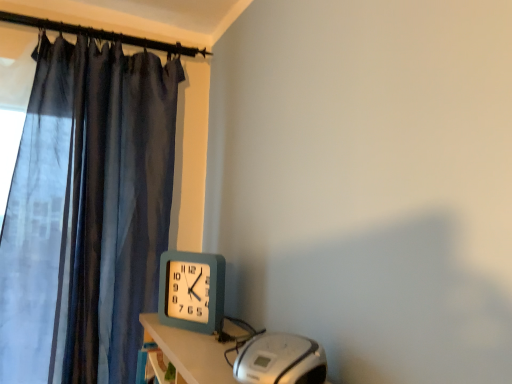
Where is `silver metallic cd player at lower right`? silver metallic cd player at lower right is located at coordinates (280, 360).

Measure the distance between point (246, 373) and camera.

A distance of 31.73 inches exists between point (246, 373) and camera.

What is the approximate height of silver metallic cd player at lower right?

The height of silver metallic cd player at lower right is 8.76 centimeters.

The height and width of the screenshot is (384, 512). What do you see at coordinates (280, 360) in the screenshot?
I see `silver metallic cd player at lower right` at bounding box center [280, 360].

What do you see at coordinates (192, 291) in the screenshot? I see `teal plastic wall clock at upper center` at bounding box center [192, 291].

At what (x,y) coordinates should I click in order to perform the action: click on teal plastic wall clock at upper center. Please return your answer as a coordinate pair (x, y). The image size is (512, 384). Looking at the image, I should click on (192, 291).

What is the approximate height of teal plastic wall clock at upper center?

teal plastic wall clock at upper center is 8.92 inches in height.

At what (x,y) coordinates should I click in order to perform the action: click on silver metallic cd player at lower right. Please return your answer as a coordinate pair (x, y). This screenshot has width=512, height=384. Looking at the image, I should click on (280, 360).

Considering the relative positions of silver metallic cd player at lower right and teal plastic wall clock at upper center in the image provided, is silver metallic cd player at lower right to the left or to the right of teal plastic wall clock at upper center?

silver metallic cd player at lower right is positioned on teal plastic wall clock at upper center's right side.

Is the position of silver metallic cd player at lower right less distant than that of teal plastic wall clock at upper center?

Yes, silver metallic cd player at lower right is closer to the viewer.

Does point (245, 354) come closer to viewer compared to point (200, 273)?

Yes, point (245, 354) is closer to viewer.

From the image's perspective, which one is positioned lower, silver metallic cd player at lower right or teal plastic wall clock at upper center?

silver metallic cd player at lower right.

From a real-world perspective, is silver metallic cd player at lower right physically located above or below teal plastic wall clock at upper center?

silver metallic cd player at lower right is below teal plastic wall clock at upper center.

Based on the photo, considering the sizes of objects silver metallic cd player at lower right and teal plastic wall clock at upper center in the image provided, who is wider, silver metallic cd player at lower right or teal plastic wall clock at upper center?

With larger width is silver metallic cd player at lower right.

Based on the photo, is silver metallic cd player at lower right taller or shorter than teal plastic wall clock at upper center?

Considering their sizes, silver metallic cd player at lower right has less height than teal plastic wall clock at upper center.

Considering the sizes of silver metallic cd player at lower right and teal plastic wall clock at upper center in the image, is silver metallic cd player at lower right bigger or smaller than teal plastic wall clock at upper center?

In the image, silver metallic cd player at lower right appears to be larger than teal plastic wall clock at upper center.

Can we say silver metallic cd player at lower right lies outside teal plastic wall clock at upper center?

Yes, silver metallic cd player at lower right is located beyond the bounds of teal plastic wall clock at upper center.

Is silver metallic cd player at lower right beside teal plastic wall clock at upper center?

No, silver metallic cd player at lower right is not beside teal plastic wall clock at upper center.

Is silver metallic cd player at lower right positioned with its back to teal plastic wall clock at upper center?

silver metallic cd player at lower right does not have its back to teal plastic wall clock at upper center.

How many degrees apart are the facing directions of silver metallic cd player at lower right and teal plastic wall clock at upper center?

silver metallic cd player at lower right and teal plastic wall clock at upper center are facing 4.7 degrees away from each other.

Could you measure the distance between silver metallic cd player at lower right and teal plastic wall clock at upper center?

silver metallic cd player at lower right and teal plastic wall clock at upper center are 17.72 inches apart from each other.

The image size is (512, 384). In the image, there is a teal plastic wall clock at upper center. Identify the location of equipment below it (from a real-world perspective). (280, 360).

Would you say teal plastic wall clock at upper center is to the left or to the right of silver metallic cd player at lower right in the picture?

Clearly, teal plastic wall clock at upper center is on the left of silver metallic cd player at lower right in the image.

Which object is closer to the camera, teal plastic wall clock at upper center or silver metallic cd player at lower right?

silver metallic cd player at lower right is in front.

Is point (176, 252) positioned in front of point (260, 346)?

No, (176, 252) is behind (260, 346).

From the image's perspective, is teal plastic wall clock at upper center above silver metallic cd player at lower right?

Yes, from the image's perspective, teal plastic wall clock at upper center is over silver metallic cd player at lower right.

From a real-world perspective, which object rests below the other?

From a 3D spatial view, silver metallic cd player at lower right is below.

In terms of width, does teal plastic wall clock at upper center look wider or thinner when compared to silver metallic cd player at lower right?

Clearly, teal plastic wall clock at upper center has less width compared to silver metallic cd player at lower right.

Considering the sizes of teal plastic wall clock at upper center and silver metallic cd player at lower right in the image, is teal plastic wall clock at upper center taller or shorter than silver metallic cd player at lower right?

Considering their sizes, teal plastic wall clock at upper center has more height than silver metallic cd player at lower right.

In the scene shown: Looking at the image, does teal plastic wall clock at upper center seem bigger or smaller compared to silver metallic cd player at lower right?

teal plastic wall clock at upper center is smaller than silver metallic cd player at lower right.

Is teal plastic wall clock at upper center not within silver metallic cd player at lower right?

teal plastic wall clock at upper center lies outside silver metallic cd player at lower right's area.

Is the surface of teal plastic wall clock at upper center in direct contact with silver metallic cd player at lower right?

There is a gap between teal plastic wall clock at upper center and silver metallic cd player at lower right.

Based on the photo, is teal plastic wall clock at upper center facing towards silver metallic cd player at lower right?

No, teal plastic wall clock at upper center does not turn towards silver metallic cd player at lower right.

Can you tell me how much teal plastic wall clock at upper center and silver metallic cd player at lower right differ in facing direction?

The angular difference between teal plastic wall clock at upper center and silver metallic cd player at lower right is 4.7 degrees.

Identify the location of wall clock that appears above the silver metallic cd player at lower right (from a real-world perspective). The image size is (512, 384). (192, 291).

Locate an element on the screen. The width and height of the screenshot is (512, 384). equipment beneath the teal plastic wall clock at upper center (from a real-world perspective) is located at coordinates (280, 360).

Where is `wall clock on the left of silver metallic cd player at lower right`? wall clock on the left of silver metallic cd player at lower right is located at coordinates (192, 291).